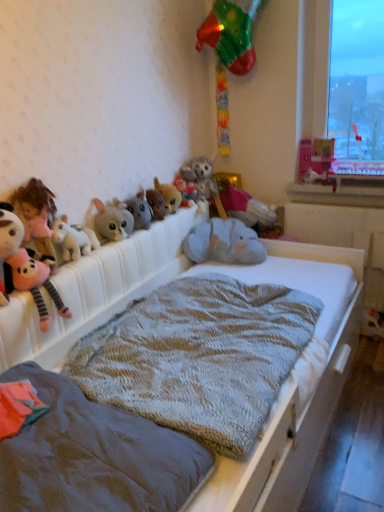
Where is `blank space above white plastic window sill at lower right (from a real-world perspective)`? The image size is (384, 512). blank space above white plastic window sill at lower right (from a real-world perspective) is located at coordinates (340, 183).